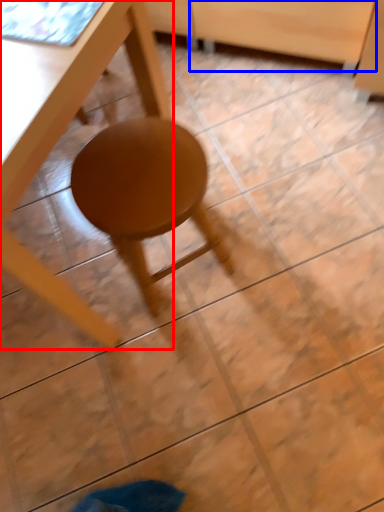
Question: Which object is further to the camera taking this photo, table (highlighted by a red box) or drawer (highlighted by a blue box)?

Choices:
 (A) table
 (B) drawer

Answer: (B)